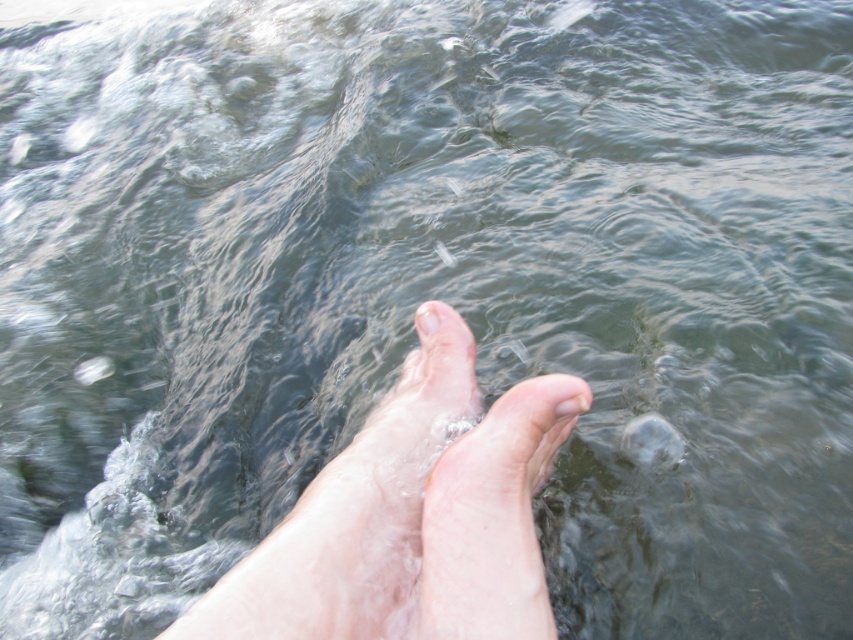
Question: Considering the relative positions of pale skin feet at center and pale skin foot at center in the image provided, where is pale skin feet at center located with respect to pale skin foot at center?

Choices:
 (A) left
 (B) right

Answer: (A)

Question: Which object is closer to the camera taking this photo?

Choices:
 (A) pale skin toe at center
 (B) pale skin feet at center
 (C) pale skin foot at center

Answer: (B)

Question: Which is nearer to the pale skin toe at center?

Choices:
 (A) pale skin foot at center
 (B) pale skin feet at center

Answer: (B)

Question: From the image, what is the correct spatial relationship of pale skin feet at center in relation to pale skin toe at center?

Choices:
 (A) above
 (B) below

Answer: (B)

Question: Which of the following is the closest to the observer?

Choices:
 (A) (496, 460)
 (B) (422, 324)

Answer: (A)

Question: Can you confirm if pale skin foot at center is smaller than pale skin toe at center?

Choices:
 (A) yes
 (B) no

Answer: (B)